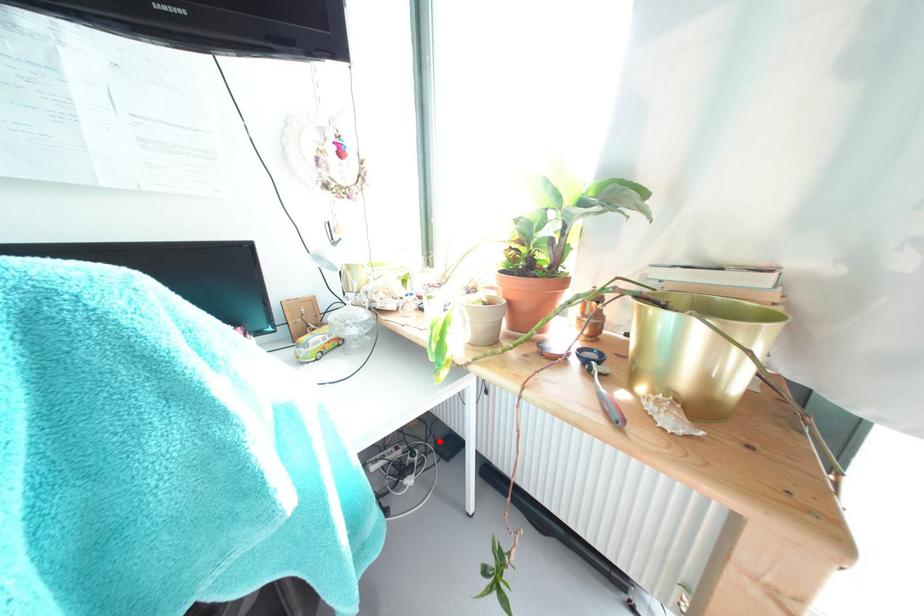
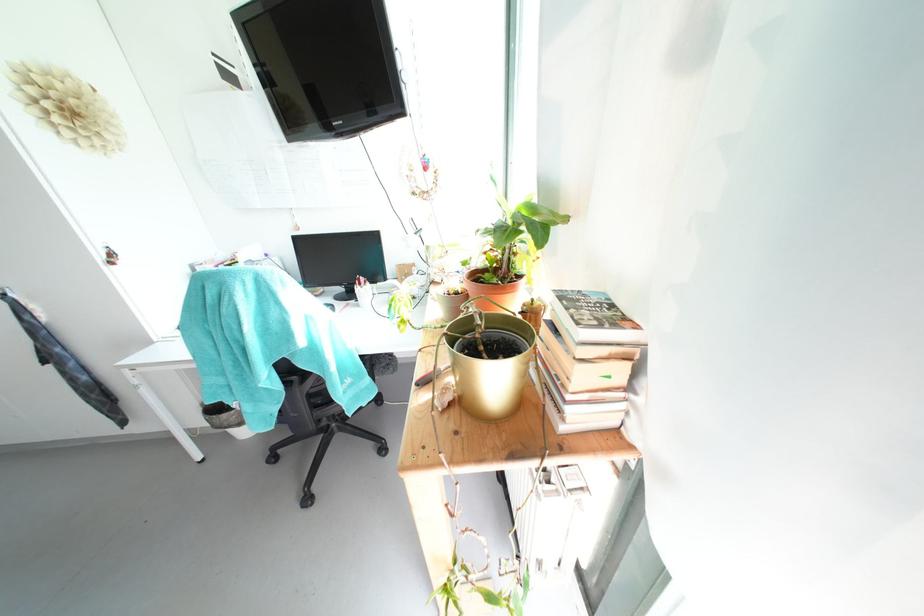
Question: I am providing you with two images of the same scene from different viewpoints. A red point is marked on the first image. At the location where the point appears in image 1, is it still visible in image 2?

Choices:
 (A) Yes
 (B) No

Answer: (B)